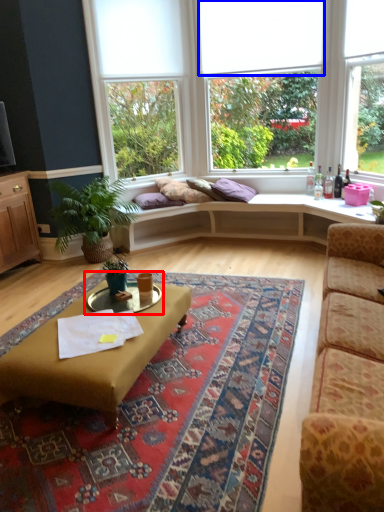
Question: Which object is closer to the camera taking this photo, cocktail table (highlighted by a red box) or blind (highlighted by a blue box)?

Choices:
 (A) cocktail table
 (B) blind

Answer: (A)